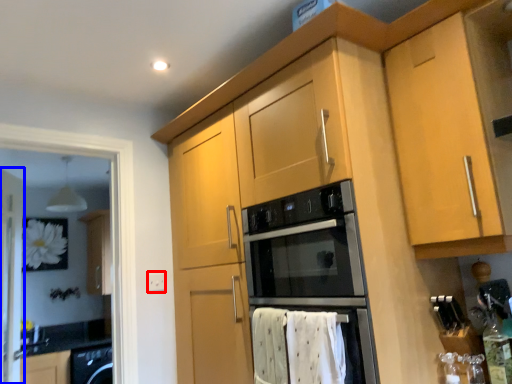
Question: Among these objects, which one is farthest to the camera, electric outlet (highlighted by a red box) or screen door (highlighted by a blue box)?

Choices:
 (A) electric outlet
 (B) screen door

Answer: (A)